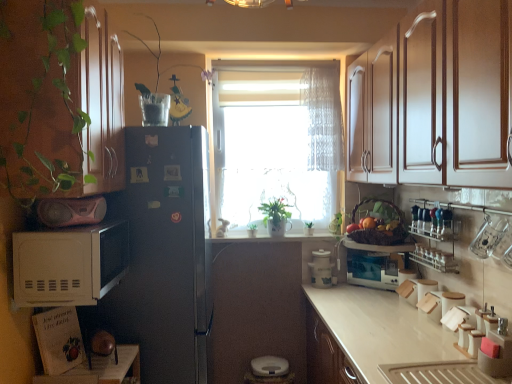
Question: Does translucent fabric curtain at center have a smaller size compared to white matte microwave at left?

Choices:
 (A) no
 (B) yes

Answer: (B)

Question: From the image's perspective, does translucent fabric curtain at center appear higher than white matte microwave at left?

Choices:
 (A) no
 (B) yes

Answer: (B)

Question: Can you confirm if translucent fabric curtain at center is positioned to the left of white matte microwave at left?

Choices:
 (A) yes
 (B) no

Answer: (B)

Question: Is translucent fabric curtain at center aimed at white matte microwave at left?

Choices:
 (A) yes
 (B) no

Answer: (B)

Question: Considering the relative positions of translucent fabric curtain at center and white matte microwave at left in the image provided, is translucent fabric curtain at center to the right of white matte microwave at left from the viewer's perspective?

Choices:
 (A) yes
 (B) no

Answer: (A)

Question: Looking at the image, does green matte plant at center seem bigger or smaller compared to pink matte boombox at left, acting as the 1th appliance starting from the left?

Choices:
 (A) small
 (B) big

Answer: (B)

Question: From a real-world perspective, is green matte plant at center above or below pink matte boombox at left, positioned as the fourth appliance in bottom-to-top order?

Choices:
 (A) above
 (B) below

Answer: (B)

Question: From the image's perspective, is green matte plant at center located above or below pink matte boombox at left, placed as the first appliance when sorted from top to bottom?

Choices:
 (A) below
 (B) above

Answer: (A)

Question: Is green matte plant at center wider or thinner than pink matte boombox at left, acting as the 1th appliance starting from the left?

Choices:
 (A) wide
 (B) thin

Answer: (B)

Question: Is white matte microwave at left bigger or smaller than green matte plant at center?

Choices:
 (A) big
 (B) small

Answer: (A)

Question: Considering their positions, is white matte microwave at left located in front of or behind green matte plant at center?

Choices:
 (A) behind
 (B) front

Answer: (B)

Question: From a real-world perspective, is white matte microwave at left positioned above or below green matte plant at center?

Choices:
 (A) below
 (B) above

Answer: (A)

Question: Is white matte microwave at left taller or shorter than green matte plant at center?

Choices:
 (A) tall
 (B) short

Answer: (A)

Question: Looking at their shapes, would you say orange matte at right is wider or thinner than translucent fabric curtain at center?

Choices:
 (A) wide
 (B) thin

Answer: (B)

Question: Based on their sizes in the image, would you say orange matte at right is bigger or smaller than translucent fabric curtain at center?

Choices:
 (A) big
 (B) small

Answer: (B)